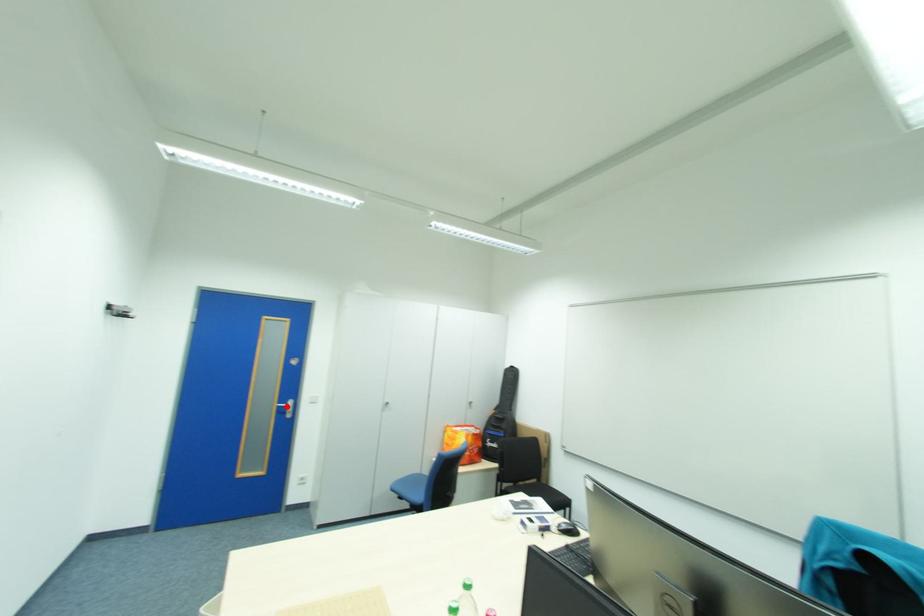
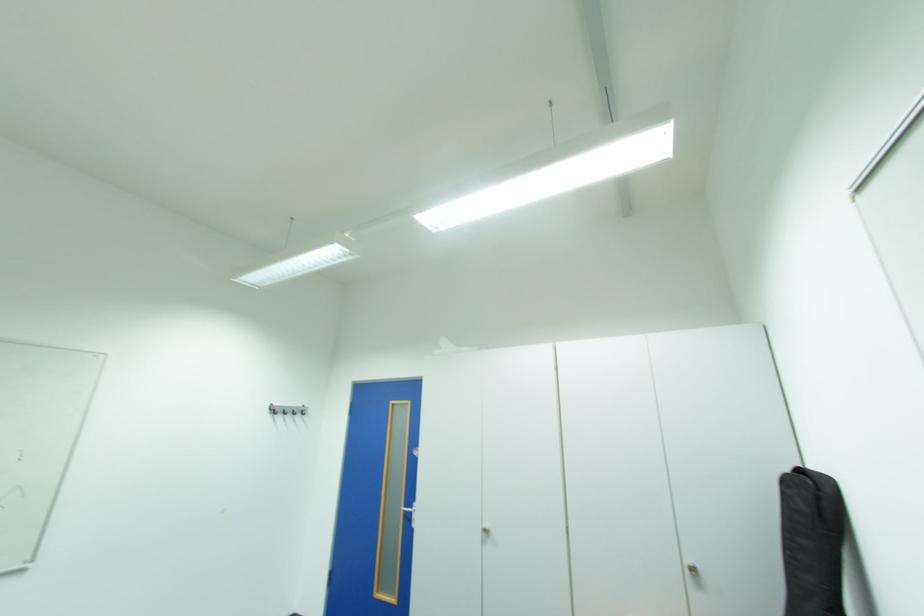
Where in the second image is the point corresponding to the highlighted location from the first image?

(414, 511)